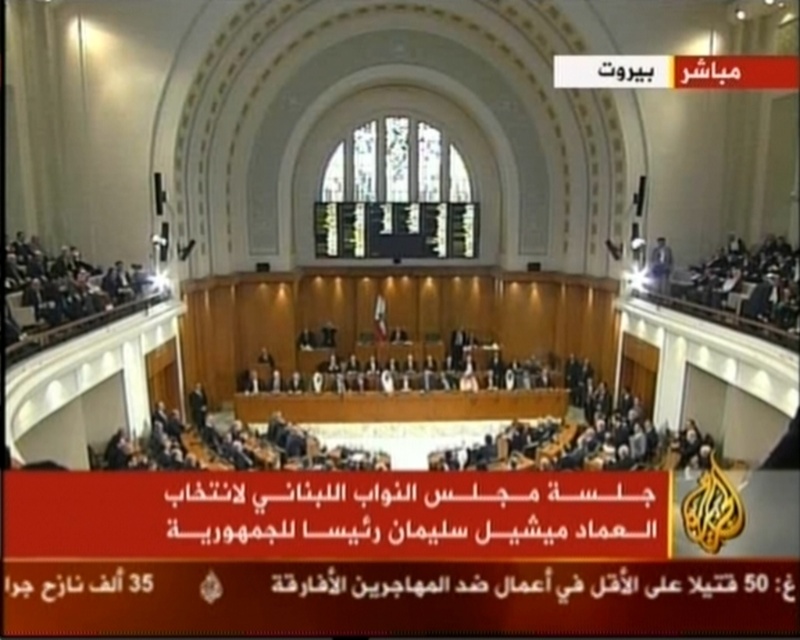
Question: Among these objects, which one is farthest from the camera?

Choices:
 (A) white glossy microphone at upper center
 (B) dark brown wooden chair at upper left

Answer: (A)

Question: Can you confirm if dark brown wooden chair at upper left is thinner than white glossy microphone at upper center?

Choices:
 (A) yes
 (B) no

Answer: (B)

Question: Does dark brown wooden chair at upper left appear on the right side of white glossy microphone at upper center?

Choices:
 (A) no
 (B) yes

Answer: (A)

Question: Where is dark brown wooden chair at upper left located in relation to white glossy microphone at upper center in the image?

Choices:
 (A) above
 (B) below

Answer: (B)

Question: Among these objects, which one is farthest from the camera?

Choices:
 (A) white glossy microphone at upper center
 (B) dark brown wooden chair at upper left

Answer: (A)